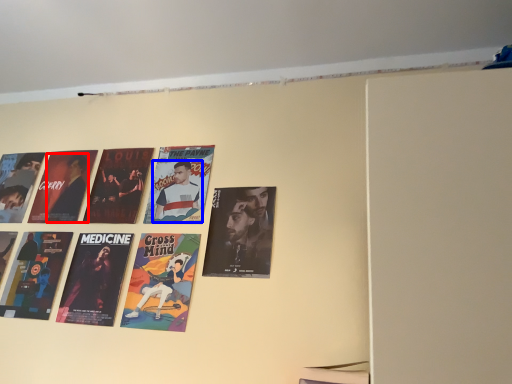
Question: Which object appears closest to the camera in this image, person (highlighted by a red box) or person (highlighted by a blue box)?

Choices:
 (A) person
 (B) person

Answer: (B)